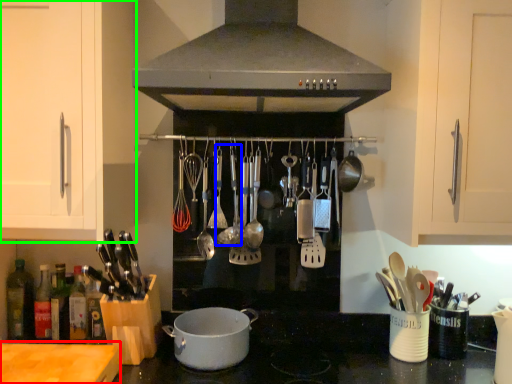
Question: Considering the real-world distances, which object is farthest from counter top (highlighted by a red box)? utensil (highlighted by a blue box) or cabinetry (highlighted by a green box)?

Choices:
 (A) utensil
 (B) cabinetry

Answer: (A)